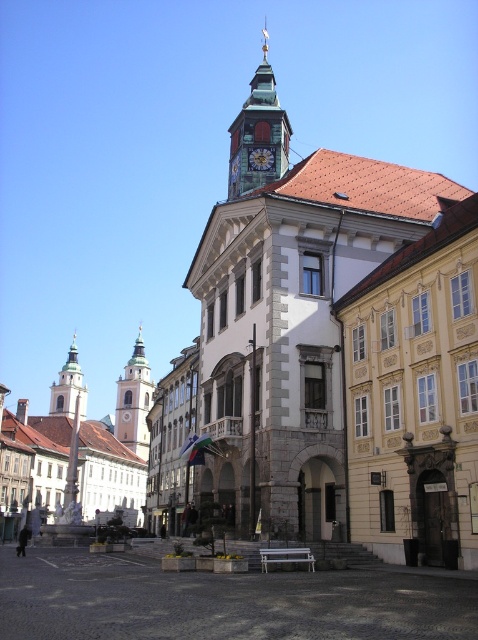
Can you confirm if green copper clock tower at upper center is smaller than green stone tower at left?

Actually, green copper clock tower at upper center might be larger than green stone tower at left.

Does green copper clock tower at upper center appear over green stone tower at left?

Yes, green copper clock tower at upper center is above green stone tower at left.

Which is behind, point (284, 156) or point (53, 387)?

Point (53, 387)

What are the coordinates of `green copper clock tower at upper center` in the screenshot? It's located at (259, 134).

Image resolution: width=478 pixels, height=640 pixels. What do you see at coordinates (68, 387) in the screenshot?
I see `green stone tower at left` at bounding box center [68, 387].

Can you confirm if green stone tower at left is positioned to the left of gold metallic clock at center?

Correct, you'll find green stone tower at left to the left of gold metallic clock at center.

Who is more distant from viewer, (74, 368) or (254, 168)?

The point (74, 368) is behind.

Identify the location of green stone tower at left. This screenshot has height=640, width=478. (68, 387).

Is green copper clock tower at upper center above gold metallic clock at center?

Yes.

Is green copper clock tower at upper center shorter than gold metallic clock at center?

No, green copper clock tower at upper center is not shorter than gold metallic clock at center.

I want to click on green copper clock tower at upper center, so click(259, 134).

Find the location of `green copper clock tower at upper center`. green copper clock tower at upper center is located at coordinates (259, 134).